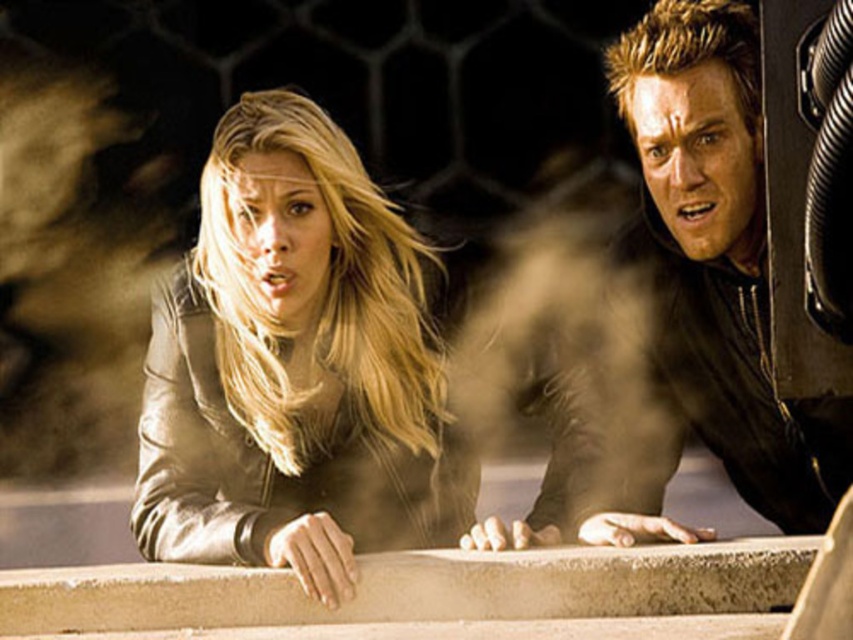
You are a fashion designer observing two jackets in a photo. The leather jacket at center and the matte black jacket at right. Which jacket is wider?

The leather jacket at center is wider than the matte black jacket at right according to the description.

You are a costume designer preparing for a scene where two actors need to wear jackets that are close enough to interact but not too close to avoid collision. The jackets are the leather jacket at center and the matte black jacket at right. Given that the actors need at least 28 inches between them for safe movement, will the jackets be positioned safely?

The leather jacket at center and the matte black jacket at right are 29.01 inches apart from each other, which is just over the required 28 inches. Therefore, the jackets are positioned safely with enough space for the actors to move without collision.